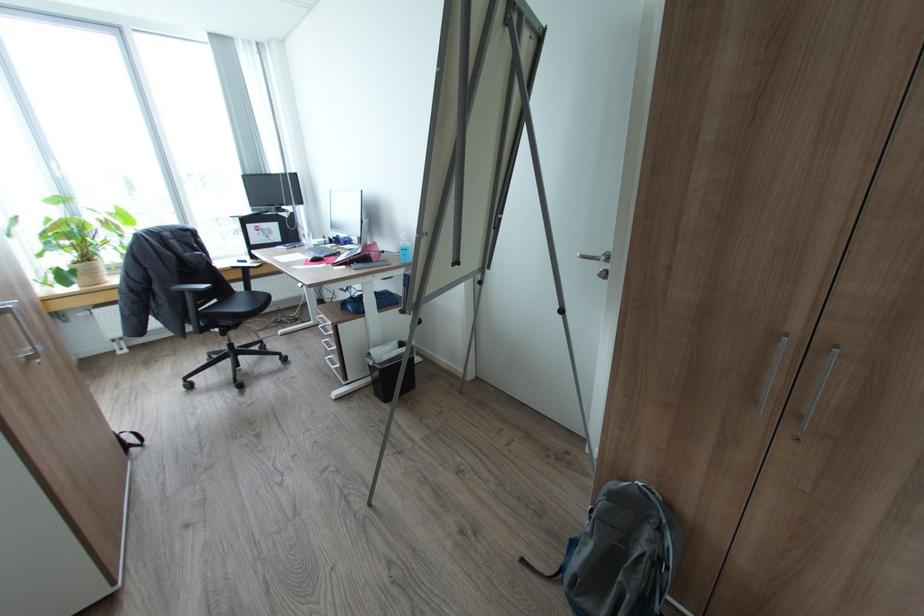
The height and width of the screenshot is (616, 924). I want to click on grey backpack, so click(621, 554).